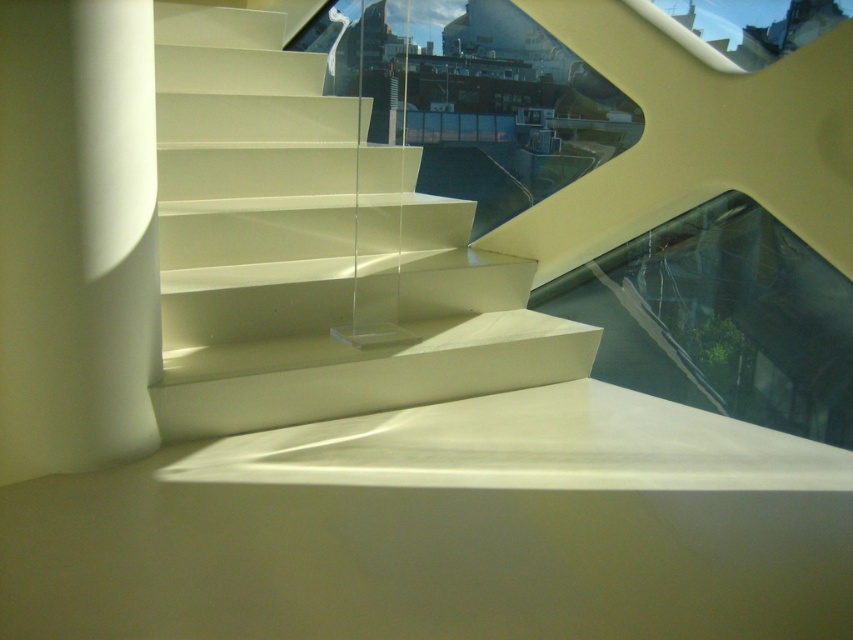
Question: Among these objects, which one is nearest to the camera?

Choices:
 (A) white glossy stairs at center
 (B) white matte pillar at left

Answer: (B)

Question: Which point is farther to the camera?

Choices:
 (A) (277, 198)
 (B) (97, 332)

Answer: (A)

Question: Is white glossy stairs at center further to camera compared to white matte pillar at left?

Choices:
 (A) yes
 (B) no

Answer: (A)

Question: Is white glossy stairs at center above white matte pillar at left?

Choices:
 (A) no
 (B) yes

Answer: (B)

Question: Does white glossy stairs at center have a larger size compared to white matte pillar at left?

Choices:
 (A) yes
 (B) no

Answer: (A)